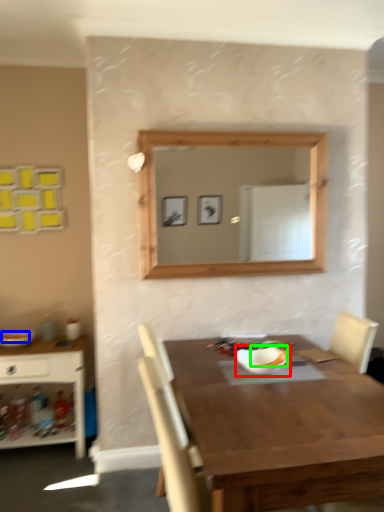
Question: Estimate the real-world distances between objects in this image. Which object is farther from bowl (highlighted by a red box), food (highlighted by a blue box) or food (highlighted by a green box)?

Choices:
 (A) food
 (B) food

Answer: (A)